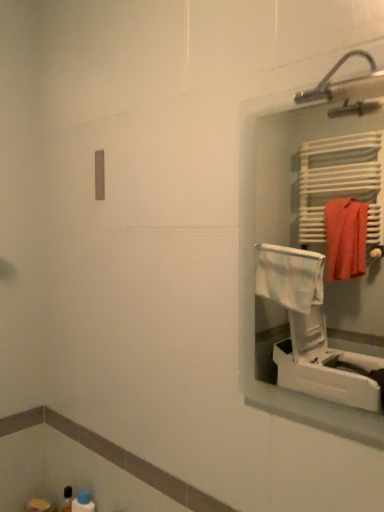
This screenshot has height=512, width=384. What are the coordinates of `blue plastic bottle at lower left` in the screenshot? It's located at (83, 502).

The width and height of the screenshot is (384, 512). What do you see at coordinates (83, 502) in the screenshot? I see `blue plastic bottle at lower left` at bounding box center [83, 502].

Locate an element on the screen. This screenshot has height=512, width=384. white plastic medicine cabinet at right is located at coordinates (311, 254).

The height and width of the screenshot is (512, 384). Describe the element at coordinates (311, 254) in the screenshot. I see `white plastic medicine cabinet at right` at that location.

Identify the location of blue plastic bottle at lower left. The image size is (384, 512). (83, 502).

Can you confirm if blue plastic bottle at lower left is positioned to the right of white plastic medicine cabinet at right?

In fact, blue plastic bottle at lower left is to the left of white plastic medicine cabinet at right.

Relative to white plastic medicine cabinet at right, is blue plastic bottle at lower left in front or behind?

Clearly, blue plastic bottle at lower left is behind white plastic medicine cabinet at right.

Considering the positions of point (92, 504) and point (305, 334), is point (92, 504) closer or farther from the camera than point (305, 334)?

Point (92, 504) is closer to the camera than point (305, 334).

From the image's perspective, does blue plastic bottle at lower left appear lower than white plastic medicine cabinet at right?

Indeed, from the image's perspective, blue plastic bottle at lower left is shown beneath white plastic medicine cabinet at right.

From a real-world perspective, relative to white plastic medicine cabinet at right, is blue plastic bottle at lower left vertically above or below?

From a real-world perspective, blue plastic bottle at lower left is physically below white plastic medicine cabinet at right.

Does blue plastic bottle at lower left have a lesser width compared to white plastic medicine cabinet at right?

Incorrect, the width of blue plastic bottle at lower left is not less than that of white plastic medicine cabinet at right.

From their relative heights in the image, would you say blue plastic bottle at lower left is taller or shorter than white plastic medicine cabinet at right?

Clearly, blue plastic bottle at lower left is shorter compared to white plastic medicine cabinet at right.

Does blue plastic bottle at lower left have a larger size compared to white plastic medicine cabinet at right?

Actually, blue plastic bottle at lower left might be smaller than white plastic medicine cabinet at right.

Choose the correct answer: Is blue plastic bottle at lower left inside white plastic medicine cabinet at right or outside it?

blue plastic bottle at lower left exists outside the volume of white plastic medicine cabinet at right.

Are blue plastic bottle at lower left and white plastic medicine cabinet at right far apart?

Yes, blue plastic bottle at lower left and white plastic medicine cabinet at right are quite far apart.

Is white plastic medicine cabinet at right at the back of blue plastic bottle at lower left?

blue plastic bottle at lower left is not turned away from white plastic medicine cabinet at right.

How distant is blue plastic bottle at lower left from white plastic medicine cabinet at right?

They are 1.77 meters apart.

Image resolution: width=384 pixels, height=512 pixels. I want to click on medicine cabinet that is on the right side of blue plastic bottle at lower left, so click(x=311, y=254).

Can you confirm if white plastic medicine cabinet at right is positioned to the left of blue plastic bottle at lower left?

No.

Relative to blue plastic bottle at lower left, is white plastic medicine cabinet at right in front or behind?

In the image, white plastic medicine cabinet at right appears in front of blue plastic bottle at lower left.

Does point (370, 161) appear closer or farther from the camera than point (77, 504)?

Clearly, point (370, 161) is more distant from the camera than point (77, 504).

From the image's perspective, is white plastic medicine cabinet at right under blue plastic bottle at lower left?

Actually, white plastic medicine cabinet at right appears above blue plastic bottle at lower left in the image.

From a real-world perspective, does white plastic medicine cabinet at right stand above blue plastic bottle at lower left?

Yes, from a real-world perspective, white plastic medicine cabinet at right is on top of blue plastic bottle at lower left.

Considering the sizes of objects white plastic medicine cabinet at right and blue plastic bottle at lower left in the image provided, who is wider, white plastic medicine cabinet at right or blue plastic bottle at lower left?

Wider between the two is blue plastic bottle at lower left.

Between white plastic medicine cabinet at right and blue plastic bottle at lower left, which one has more height?

white plastic medicine cabinet at right is taller.

Is white plastic medicine cabinet at right smaller than blue plastic bottle at lower left?

Incorrect, white plastic medicine cabinet at right is not smaller in size than blue plastic bottle at lower left.

Is white plastic medicine cabinet at right not inside blue plastic bottle at lower left?

white plastic medicine cabinet at right lies outside blue plastic bottle at lower left's area.

Is white plastic medicine cabinet at right placed right next to blue plastic bottle at lower left?

No, white plastic medicine cabinet at right is not with blue plastic bottle at lower left.

In the scene shown: Is white plastic medicine cabinet at right facing away from blue plastic bottle at lower left?

No, blue plastic bottle at lower left is not at the back of white plastic medicine cabinet at right.

What's the angular difference between white plastic medicine cabinet at right and blue plastic bottle at lower left's facing directions?

The facing directions of white plastic medicine cabinet at right and blue plastic bottle at lower left are 0.335 degrees apart.

The height and width of the screenshot is (512, 384). I want to click on medicine cabinet above the blue plastic bottle at lower left (from a real-world perspective), so click(x=311, y=254).

Find the location of a particular element. toiletry below the white plastic medicine cabinet at right (from the image's perspective) is located at coordinates (83, 502).

In order to click on medicine cabinet on the right of blue plastic bottle at lower left in this screenshot , I will do `click(311, 254)`.